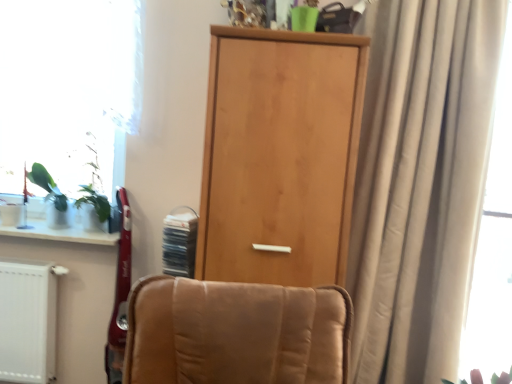
Question: Is beige fabric curtain at right far away from light wood door at center?

Choices:
 (A) no
 (B) yes

Answer: (A)

Question: From the image's perspective, is beige fabric curtain at right beneath light wood door at center?

Choices:
 (A) yes
 (B) no

Answer: (A)

Question: Is light wood door at center at the back of beige fabric curtain at right?

Choices:
 (A) no
 (B) yes

Answer: (A)

Question: Is beige fabric curtain at right to the right of light wood door at center from the viewer's perspective?

Choices:
 (A) no
 (B) yes

Answer: (B)

Question: Is beige fabric curtain at right oriented towards light wood door at center?

Choices:
 (A) no
 (B) yes

Answer: (A)

Question: Relative to light wood door at center, is white glossy window sill at lower left in front or behind?

Choices:
 (A) front
 (B) behind

Answer: (B)

Question: Is white glossy window sill at lower left spatially inside light wood door at center, or outside of it?

Choices:
 (A) inside
 (B) outside

Answer: (B)

Question: In terms of height, does white glossy window sill at lower left look taller or shorter compared to light wood door at center?

Choices:
 (A) tall
 (B) short

Answer: (B)

Question: From the image's perspective, is white glossy window sill at lower left positioned above or below light wood door at center?

Choices:
 (A) above
 (B) below

Answer: (B)

Question: Considering their positions, is transparent glass window at left located in front of or behind white glossy window sill at lower left?

Choices:
 (A) front
 (B) behind

Answer: (B)

Question: Is point (53, 46) positioned closer to the camera than point (96, 241)?

Choices:
 (A) farther
 (B) closer

Answer: (B)

Question: Is transparent glass window at left bigger or smaller than white glossy window sill at lower left?

Choices:
 (A) big
 (B) small

Answer: (A)

Question: Choose the correct answer: Is transparent glass window at left inside white glossy window sill at lower left or outside it?

Choices:
 (A) outside
 (B) inside

Answer: (A)

Question: Is beige fabric curtain at right taller or shorter than translucent fabric curtain at right?

Choices:
 (A) tall
 (B) short

Answer: (A)

Question: In the image, is beige fabric curtain at right positioned in front of or behind translucent fabric curtain at right?

Choices:
 (A) behind
 (B) front

Answer: (B)